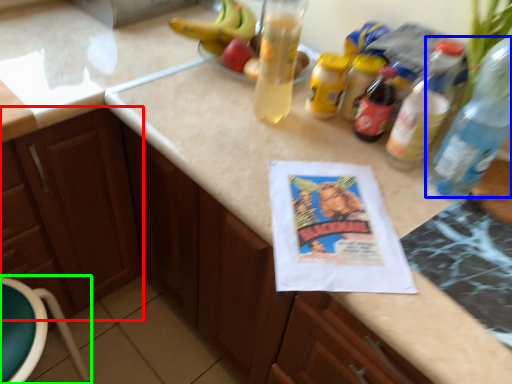
Question: Which object is the farthest from cabinetry (highlighted by a red box)? Choose among these: bottle (highlighted by a blue box) or bar stool (highlighted by a green box).

Choices:
 (A) bottle
 (B) bar stool

Answer: (A)